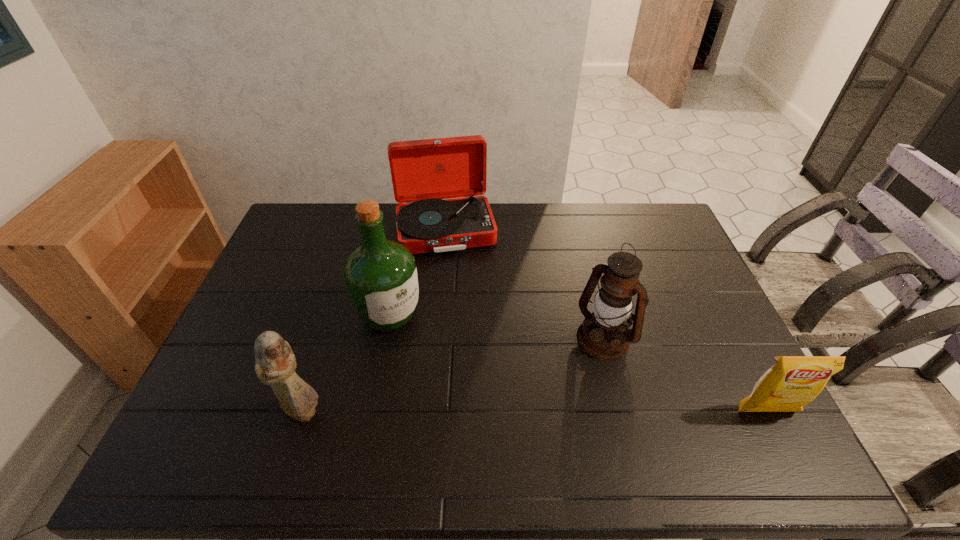
At what (x,y) coordinates should I click in order to perform the action: click on figurine. Please return your answer as a coordinate pair (x, y). This screenshot has height=540, width=960. Looking at the image, I should click on (275, 365).

The height and width of the screenshot is (540, 960). In order to click on the rightmost object in this screenshot , I will do `click(793, 381)`.

I want to click on crisp (potato chip), so click(793, 381).

Identify the location of the second object from right to left. point(603,334).

This screenshot has height=540, width=960. In order to click on liquor in this screenshot , I will do `click(380, 275)`.

Locate an element on the screen. This screenshot has height=540, width=960. phonograph_record is located at coordinates pyautogui.click(x=424, y=172).

The width and height of the screenshot is (960, 540). Identify the location of free point located 0.300m on the front-facing side of the figurine. (448, 411).

Where is `free space located on the side of the lantern, there is a wick adjustment knob`? This screenshot has height=540, width=960. free space located on the side of the lantern, there is a wick adjustment knob is located at coordinates (564, 379).

Where is `vacant region located 0.230m on the side of the lantern, there is a wick adjustment knob`? This screenshot has height=540, width=960. vacant region located 0.230m on the side of the lantern, there is a wick adjustment knob is located at coordinates (535, 409).

Locate an element on the screen. This screenshot has height=540, width=960. free space located on the side of the lantern, there is a wick adjustment knob is located at coordinates (537, 407).